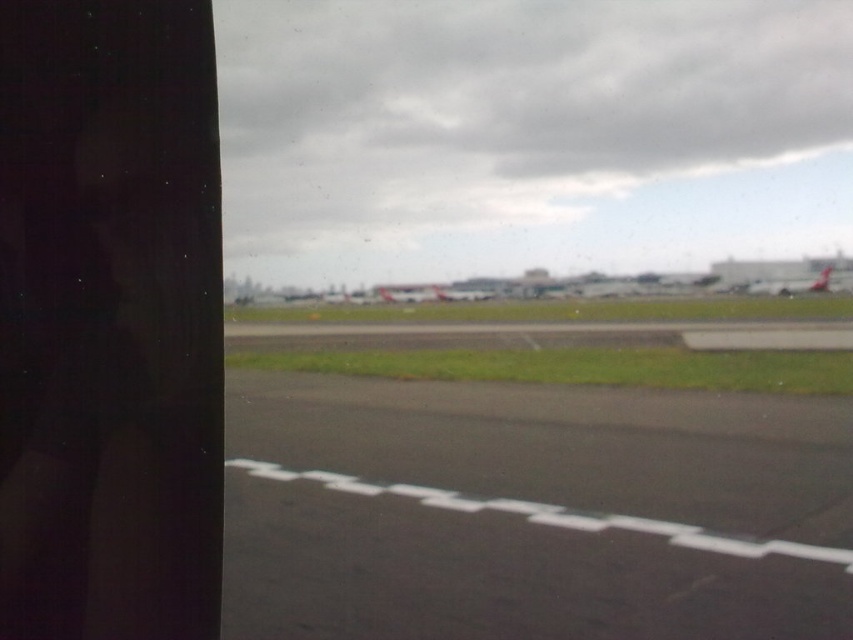
Question: Can you confirm if black asphalt tarmac at center is bigger than metallic silver airplane at right?

Choices:
 (A) yes
 (B) no

Answer: (B)

Question: Which point is farther to the camera?

Choices:
 (A) black asphalt tarmac at center
 (B) metallic silver airplane at right

Answer: (B)

Question: Can you confirm if black asphalt tarmac at center is positioned above metallic silver airplane at right?

Choices:
 (A) yes
 (B) no

Answer: (B)

Question: Among these objects, which one is nearest to the camera?

Choices:
 (A) black asphalt tarmac at center
 (B) metallic silver airplane at right

Answer: (A)

Question: Can you confirm if black asphalt tarmac at center is wider than metallic silver airplane at right?

Choices:
 (A) yes
 (B) no

Answer: (B)

Question: Which point is closer to the camera taking this photo?

Choices:
 (A) (405, 604)
 (B) (827, 269)

Answer: (A)